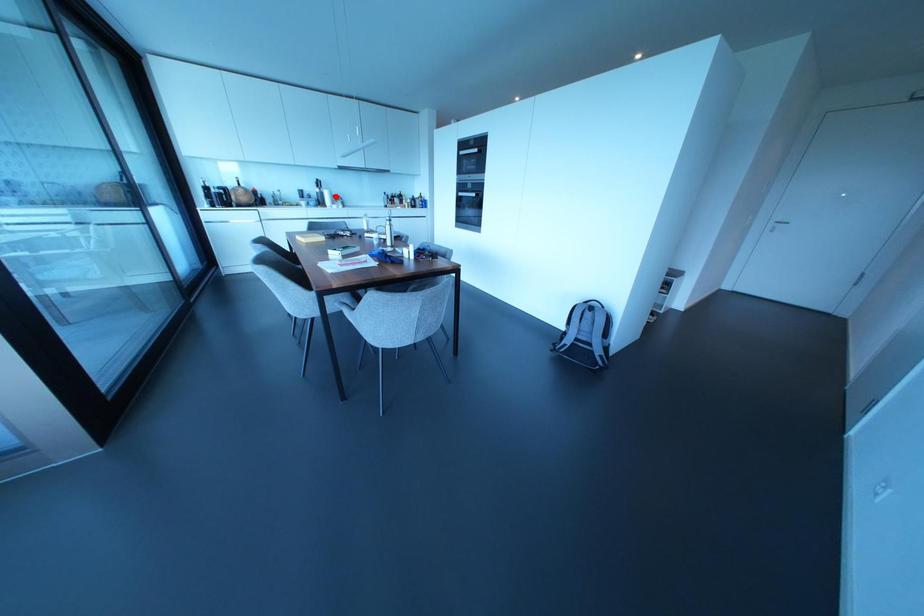
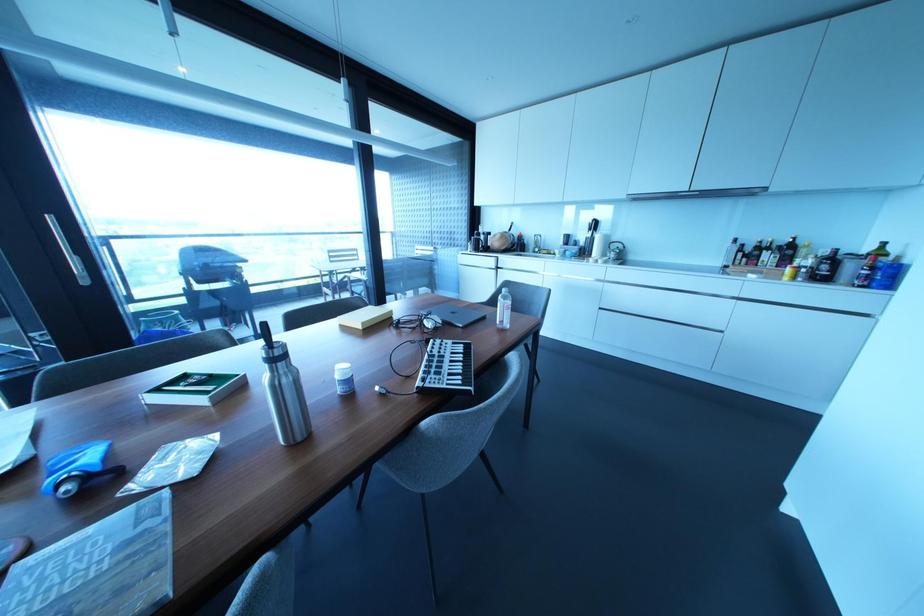
Question: I am providing you with two images of the same scene from different viewpoints. A red point is marked on the first image. Can you still see the location of the red point in image 2?

Choices:
 (A) Yes
 (B) No

Answer: (A)